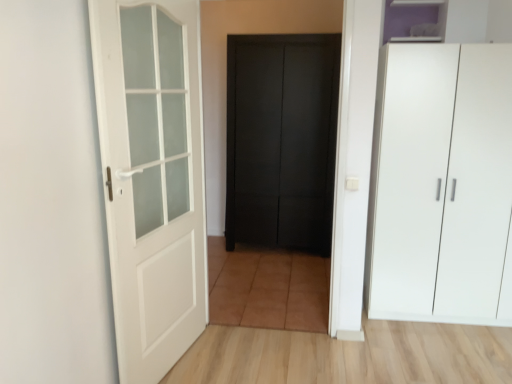
Question: Considering the relative sizes of white matte door at left, the 2th door when ordered from back to front, and white matte cupboard at right in the image provided, is white matte door at left, the 2th door when ordered from back to front, smaller than white matte cupboard at right?

Choices:
 (A) no
 (B) yes

Answer: (B)

Question: Is white matte cupboard at right at the back of white matte door at left, the first door positioned from the left?

Choices:
 (A) yes
 (B) no

Answer: (B)

Question: Is white matte door at left, which ranks as the 1th door in front-to-back order, thinner than white matte cupboard at right?

Choices:
 (A) no
 (B) yes

Answer: (B)

Question: Does white matte door at left, which ranks as the 1th door in front-to-back order, have a greater width compared to white matte cupboard at right?

Choices:
 (A) yes
 (B) no

Answer: (B)

Question: Is white matte door at left, the 2th door positioned from the right, to the left of white matte cupboard at right from the viewer's perspective?

Choices:
 (A) yes
 (B) no

Answer: (A)

Question: Looking at their shapes, would you say white matte cupboard at right is wider or thinner than matte black door at center, placed as the second door when sorted from left to right?

Choices:
 (A) wide
 (B) thin

Answer: (A)

Question: Based on their sizes in the image, would you say white matte cupboard at right is bigger or smaller than matte black door at center, positioned as the 1th door in back-to-front order?

Choices:
 (A) small
 (B) big

Answer: (B)

Question: Is white matte cupboard at right inside the boundaries of matte black door at center, positioned as the 1th door in back-to-front order, or outside?

Choices:
 (A) outside
 (B) inside

Answer: (A)

Question: From a real-world perspective, is white matte cupboard at right above or below matte black door at center, placed as the second door when sorted from left to right?

Choices:
 (A) below
 (B) above

Answer: (A)

Question: From the image's perspective, relative to white matte cupboard at right, is purple matte cabinet at upper right above or below?

Choices:
 (A) below
 (B) above

Answer: (B)

Question: Considering the positions of purple matte cabinet at upper right and white matte cupboard at right in the image, is purple matte cabinet at upper right wider or thinner than white matte cupboard at right?

Choices:
 (A) wide
 (B) thin

Answer: (B)

Question: Considering the positions of point (412, 8) and point (496, 228), is point (412, 8) closer or farther from the camera than point (496, 228)?

Choices:
 (A) farther
 (B) closer

Answer: (A)

Question: Is purple matte cabinet at upper right taller or shorter than white matte cupboard at right?

Choices:
 (A) short
 (B) tall

Answer: (A)

Question: Based on their positions, is white matte cupboard at right located to the left or right of white matte door at left, which ranks as the 1th door in front-to-back order?

Choices:
 (A) left
 (B) right

Answer: (B)

Question: From their relative heights in the image, would you say white matte cupboard at right is taller or shorter than white matte door at left, the 2th door positioned from the right?

Choices:
 (A) tall
 (B) short

Answer: (B)